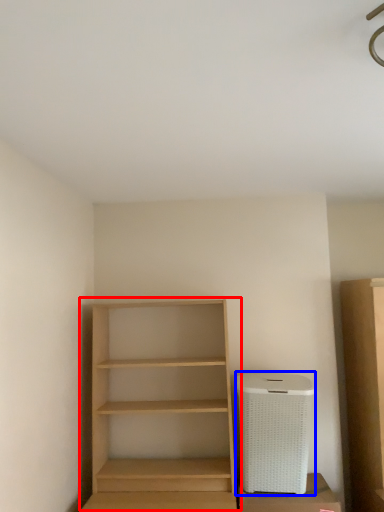
Question: Which point is further to the camera, shelf (highlighted by a red box) or appliance (highlighted by a blue box)?

Choices:
 (A) shelf
 (B) appliance

Answer: (B)